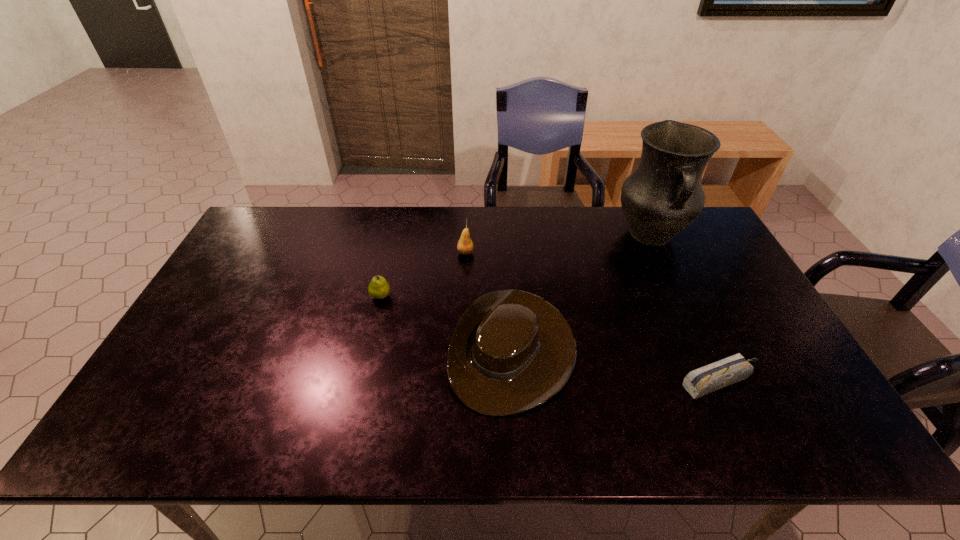
Locate an element on the screen. vacant space at the left edge of the desktop is located at coordinates (220, 374).

In the image, there is a desktop. In order to click on vacant region at the right edge in this screenshot , I will do `click(789, 392)`.

This screenshot has height=540, width=960. In the image, there is a desktop. In order to click on vacant space at the far left corner in this screenshot , I will do `click(296, 232)`.

Locate an element on the screen. This screenshot has width=960, height=540. vacant area at the far right corner of the desktop is located at coordinates tap(699, 231).

At what (x,y) coordinates should I click in order to perform the action: click on free spot between the pencil box and the cowboy hat. Please return your answer as a coordinate pair (x, y). Looking at the image, I should click on (617, 366).

Find the location of a particular element. vacant area that lies between the right pear and the left pear is located at coordinates (423, 274).

Identify the location of vacant area that lies between the tallest object and the taller pear. (559, 244).

You are a GUI agent. You are given a task and a screenshot of the screen. Output one action in this format:
    pyautogui.click(x=<x>, y=<y>)
    Task: Click on the empty space between the pitcher and the pencil box
    The image size is (960, 540).
    Given the screenshot: What is the action you would take?
    pyautogui.click(x=686, y=308)

Find the location of a particular element. This screenshot has height=540, width=960. free space between the tallest object and the nearer pear is located at coordinates point(516,266).

I want to click on free space between the shorter pear and the tallest object, so click(x=516, y=266).